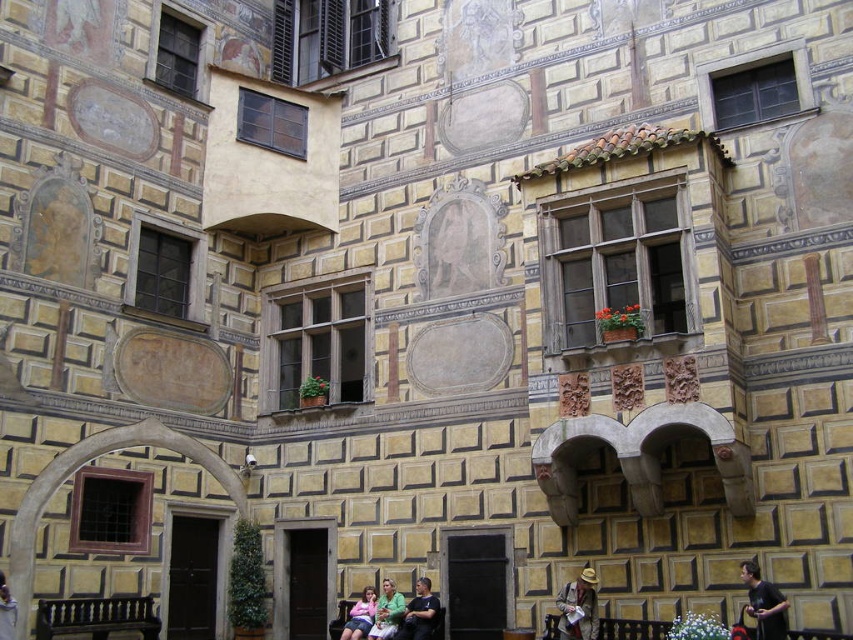
The width and height of the screenshot is (853, 640). I want to click on leather hat at center, so click(578, 608).

Where is `leather hat at center`? leather hat at center is located at coordinates (578, 608).

Is point (759, 612) less distant than point (416, 595)?

Yes.

Can you confirm if black fabric shirt at lower right is positioned to the right of matte black shirt at center?

Indeed, black fabric shirt at lower right is positioned on the right side of matte black shirt at center.

The image size is (853, 640). I want to click on black fabric shirt at lower right, so click(x=764, y=604).

The height and width of the screenshot is (640, 853). What are the coordinates of `black fabric shirt at lower right` in the screenshot? It's located at (764, 604).

Between point (438, 602) and point (387, 630), which one is positioned behind?

The point (438, 602) is behind.

Where is `matte black shirt at center`? The image size is (853, 640). matte black shirt at center is located at coordinates (421, 612).